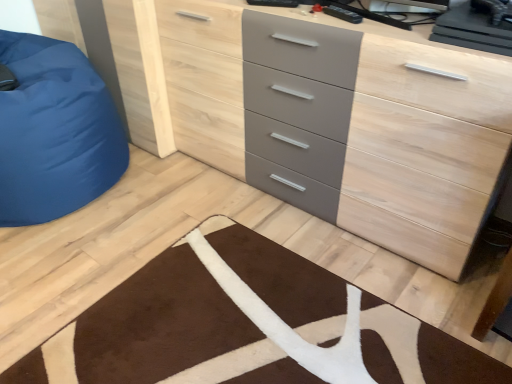
Question: Is matte gray chest of drawers at center touching blue fabric bean bag at left?

Choices:
 (A) no
 (B) yes

Answer: (A)

Question: From a real-world perspective, is matte gray chest of drawers at center beneath blue fabric bean bag at left?

Choices:
 (A) no
 (B) yes

Answer: (A)

Question: Considering the relative sizes of matte gray chest of drawers at center and blue fabric bean bag at left in the image provided, is matte gray chest of drawers at center bigger than blue fabric bean bag at left?

Choices:
 (A) no
 (B) yes

Answer: (A)

Question: Is matte gray chest of drawers at center thinner than blue fabric bean bag at left?

Choices:
 (A) no
 (B) yes

Answer: (B)

Question: Considering the relative sizes of matte gray chest of drawers at center and blue fabric bean bag at left in the image provided, is matte gray chest of drawers at center taller than blue fabric bean bag at left?

Choices:
 (A) no
 (B) yes

Answer: (B)

Question: Is blue fabric bean bag at left inside matte gray chest of drawers at center?

Choices:
 (A) no
 (B) yes

Answer: (A)

Question: From the image's perspective, is blue fabric bean bag at left over brown plush rug at lower center?

Choices:
 (A) no
 (B) yes

Answer: (B)

Question: Is blue fabric bean bag at left looking in the opposite direction of brown plush rug at lower center?

Choices:
 (A) no
 (B) yes

Answer: (A)

Question: Is blue fabric bean bag at left oriented towards brown plush rug at lower center?

Choices:
 (A) no
 (B) yes

Answer: (A)

Question: Would you say brown plush rug at lower center is part of blue fabric bean bag at left's contents?

Choices:
 (A) yes
 (B) no

Answer: (B)

Question: Is blue fabric bean bag at left to the left of brown plush rug at lower center from the viewer's perspective?

Choices:
 (A) no
 (B) yes

Answer: (B)

Question: Considering the relative sizes of blue fabric bean bag at left and brown plush rug at lower center in the image provided, is blue fabric bean bag at left bigger than brown plush rug at lower center?

Choices:
 (A) no
 (B) yes

Answer: (B)

Question: Is matte gray chest of drawers at center facing away from brown plush rug at lower center?

Choices:
 (A) yes
 (B) no

Answer: (B)